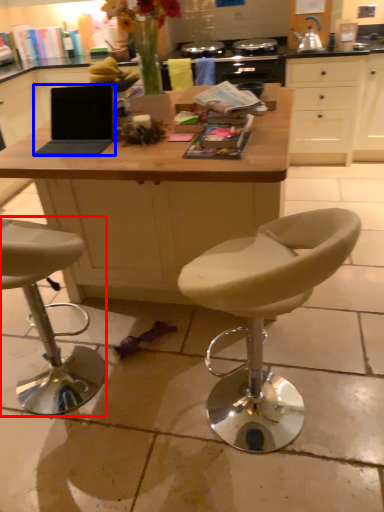
Question: Which object is closer to the camera taking this photo, chair (highlighted by a red box) or laptop (highlighted by a blue box)?

Choices:
 (A) chair
 (B) laptop

Answer: (A)